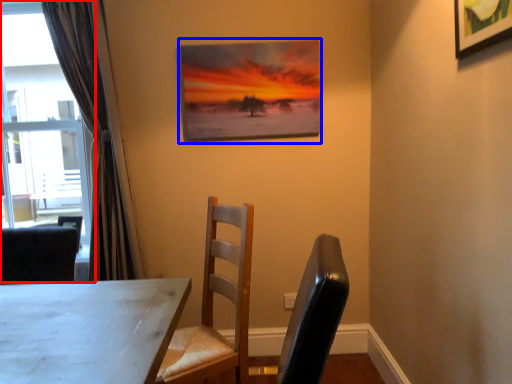
Question: Which point is further to the camera, window (highlighted by a red box) or picture frame (highlighted by a blue box)?

Choices:
 (A) window
 (B) picture frame

Answer: (B)